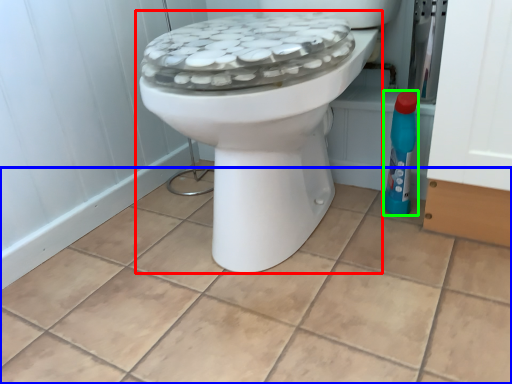
Question: Based on their relative distances, which object is nearer to toilet (highlighted by a red box)? Choose from ceramic tile (highlighted by a blue box) and cleaning product (highlighted by a green box).

Choices:
 (A) ceramic tile
 (B) cleaning product

Answer: (A)